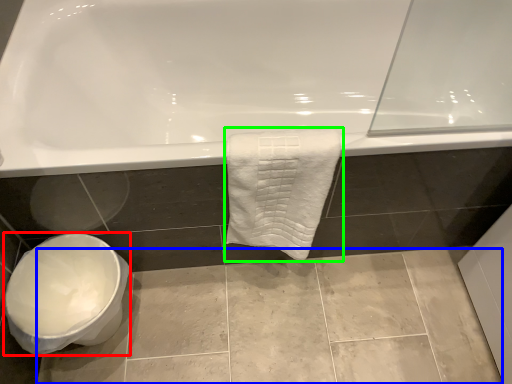
Question: Which object is the closest to the toilet bowl (highlighted by a red box)? Choose among these: ceramic tile (highlighted by a blue box) or towel (highlighted by a green box).

Choices:
 (A) ceramic tile
 (B) towel

Answer: (A)